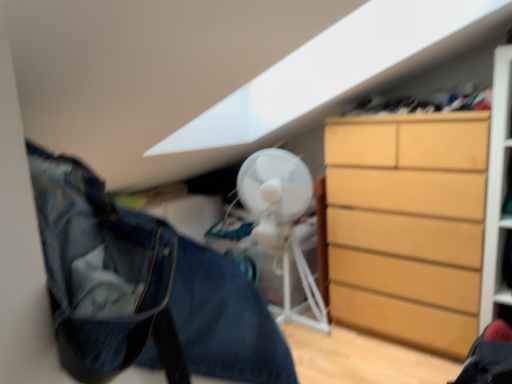
Image resolution: width=512 pixels, height=384 pixels. Identify the location of white plastic mechanical fan at center. (282, 222).

Where is `light brown wooden chest of drawers at right`? light brown wooden chest of drawers at right is located at coordinates (407, 225).

You are a GUI agent. You are given a task and a screenshot of the screen. Output one action in this format:
    pyautogui.click(x=<x>, y=<y>)
    Task: Click on the chest of drawers above the white plastic mechanical fan at center (from the image's perspective)
    The width and height of the screenshot is (512, 384).
    Given the screenshot: What is the action you would take?
    pyautogui.click(x=407, y=225)

From the image's perspective, which is below, light brown wooden chest of drawers at right or white plastic mechanical fan at center?

white plastic mechanical fan at center is shown below in the image.

What's the angular difference between light brown wooden chest of drawers at right and white plastic mechanical fan at center's facing directions?

The angular difference between light brown wooden chest of drawers at right and white plastic mechanical fan at center is 6.67 degrees.

From a real-world perspective, is light brown wooden chest of drawers at right positioned under white plastic mechanical fan at center based on gravity?

Actually, light brown wooden chest of drawers at right is physically above white plastic mechanical fan at center in the real world.

Does point (274, 180) come closer to viewer compared to point (373, 171)?

No, (274, 180) is further to viewer.

Can you confirm if white plastic mechanical fan at center is positioned to the right of light brown wooden chest of drawers at right?

In fact, white plastic mechanical fan at center is to the left of light brown wooden chest of drawers at right.

There is a white plastic mechanical fan at center. Where is `the chest of drawers above it (from a real-world perspective)`? This screenshot has width=512, height=384. the chest of drawers above it (from a real-world perspective) is located at coordinates point(407,225).

From the image's perspective, which one is positioned higher, white plastic mechanical fan at center or denim jacket at lower left?

white plastic mechanical fan at center appears higher in the image.

Is denim jacket at lower left inside white plastic mechanical fan at center?

No, white plastic mechanical fan at center does not contain denim jacket at lower left.

Is white plastic mechanical fan at center smaller than denim jacket at lower left?

Incorrect, white plastic mechanical fan at center is not smaller in size than denim jacket at lower left.

Considering the relative sizes of light brown wooden chest of drawers at right and denim jacket at lower left in the image provided, is light brown wooden chest of drawers at right bigger than denim jacket at lower left?

Yes.

Relative to denim jacket at lower left, is light brown wooden chest of drawers at right in front or behind?

Clearly, light brown wooden chest of drawers at right is behind denim jacket at lower left.

Considering the sizes of objects light brown wooden chest of drawers at right and denim jacket at lower left in the image provided, who is wider, light brown wooden chest of drawers at right or denim jacket at lower left?

Wider between the two is denim jacket at lower left.

Which of these two, light brown wooden chest of drawers at right or denim jacket at lower left, stands shorter?

A: denim jacket at lower left.

Does denim jacket at lower left appear on the right side of light brown wooden chest of drawers at right?

Incorrect, denim jacket at lower left is not on the right side of light brown wooden chest of drawers at right.

Can we say denim jacket at lower left lies outside light brown wooden chest of drawers at right?

Yes, denim jacket at lower left is outside of light brown wooden chest of drawers at right.

From a real-world perspective, is denim jacket at lower left beneath light brown wooden chest of drawers at right?

No, from a real-world perspective, denim jacket at lower left is not beneath light brown wooden chest of drawers at right.

Is denim jacket at lower left oriented away from light brown wooden chest of drawers at right?

No, denim jacket at lower left's orientation is not away from light brown wooden chest of drawers at right.

Is point (60, 183) farther from viewer compared to point (248, 208)?

No, it is not.

Does denim jacket at lower left have a greater height compared to white plastic mechanical fan at center?

Incorrect, the height of denim jacket at lower left is not larger of that of white plastic mechanical fan at center.

There is a white plastic mechanical fan at center. What are the coordinates of `the chest of drawers above it (from a real-world perspective)` in the screenshot? It's located at (407, 225).

This screenshot has height=384, width=512. Identify the location of mechanical fan behind the light brown wooden chest of drawers at right. (282, 222).

Estimate the real-world distances between objects in this image. Which object is closer to denim jacket at lower left, white plastic mechanical fan at center or light brown wooden chest of drawers at right?

light brown wooden chest of drawers at right.

Based on their spatial positions, is denim jacket at lower left or light brown wooden chest of drawers at right further from white plastic mechanical fan at center?

Based on the image, denim jacket at lower left appears to be further to white plastic mechanical fan at center.

Based on the photo, based on their spatial positions, is denim jacket at lower left or white plastic mechanical fan at center closer to light brown wooden chest of drawers at right?

white plastic mechanical fan at center is closer to light brown wooden chest of drawers at right.

From the image, which object appears to be farther from light brown wooden chest of drawers at right, white plastic mechanical fan at center or denim jacket at lower left?

denim jacket at lower left is further to light brown wooden chest of drawers at right.

Based on their spatial positions, is light brown wooden chest of drawers at right or denim jacket at lower left closer to white plastic mechanical fan at center?

Based on the image, light brown wooden chest of drawers at right appears to be nearer to white plastic mechanical fan at center.

Looking at the image, which one is located further to denim jacket at lower left, light brown wooden chest of drawers at right or white plastic mechanical fan at center?

Among the two, white plastic mechanical fan at center is located further to denim jacket at lower left.

You are a GUI agent. You are given a task and a screenshot of the screen. Output one action in this format:
    pyautogui.click(x=<x>, y=<y>)
    Task: Click on the chest of drawers between denim jacket at lower left and white plastic mechanical fan at center along the z-axis
    
    Given the screenshot: What is the action you would take?
    pyautogui.click(x=407, y=225)